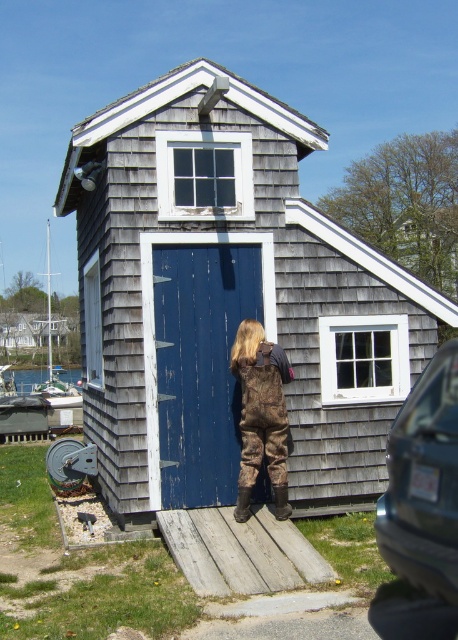
Can you confirm if gray shingled hut at center is positioned above blue weathered wood door at center?

Yes.

Is point (157, 131) behind point (190, 282)?

No, it is not.

This screenshot has width=458, height=640. Find the location of `gray shingled hut at center`. gray shingled hut at center is located at coordinates (228, 298).

Can you confirm if gray shingled hut at center is taller than camouflage waders at center?

Indeed, gray shingled hut at center has a greater height compared to camouflage waders at center.

Where is `gray shingled hut at center`? The image size is (458, 640). gray shingled hut at center is located at coordinates (228, 298).

Can you confirm if blue weathered wood door at center is thinner than camouflage waders at center?

Incorrect, blue weathered wood door at center's width is not less than camouflage waders at center's.

Can you confirm if blue weathered wood door at center is positioned above camouflage waders at center?

Yes, blue weathered wood door at center is above camouflage waders at center.

This screenshot has height=640, width=458. Identify the location of blue weathered wood door at center. (200, 365).

Where is `blue weathered wood door at center`? The image size is (458, 640). blue weathered wood door at center is located at coordinates (200, 365).